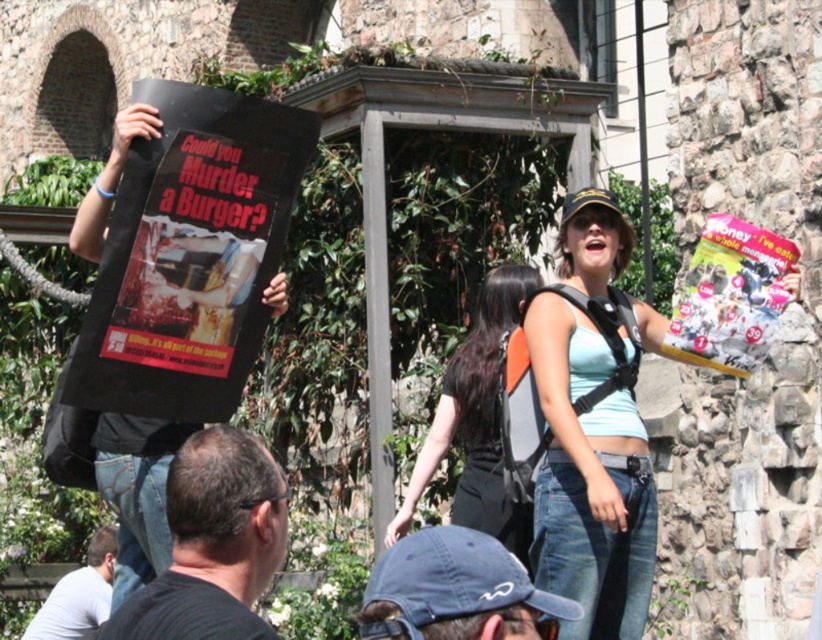
Question: Is black matte shirt at lower center to the right of black fabric backpack at center from the viewer's perspective?

Choices:
 (A) no
 (B) yes

Answer: (A)

Question: Does black t-shirt at left appear on the left side of denim cap at lower center?

Choices:
 (A) no
 (B) yes

Answer: (B)

Question: Estimate the real-world distances between objects in this image. Which object is farther from the black paper poster at left?

Choices:
 (A) denim cap at lower center
 (B) black t-shirt at left
 (C) light gray shirt at lower left
 (D) black matte shirt at lower center

Answer: (C)

Question: Which point is farther to the camera?

Choices:
 (A) light blue denim jeans at center
 (B) black matte shirt at lower center

Answer: (A)

Question: Estimate the real-world distances between objects in this image. Which object is farther from the light gray shirt at lower left?

Choices:
 (A) black t-shirt at left
 (B) black fabric backpack at center

Answer: (B)

Question: Does light blue denim jeans at center come in front of black matte shirt at lower center?

Choices:
 (A) no
 (B) yes

Answer: (A)